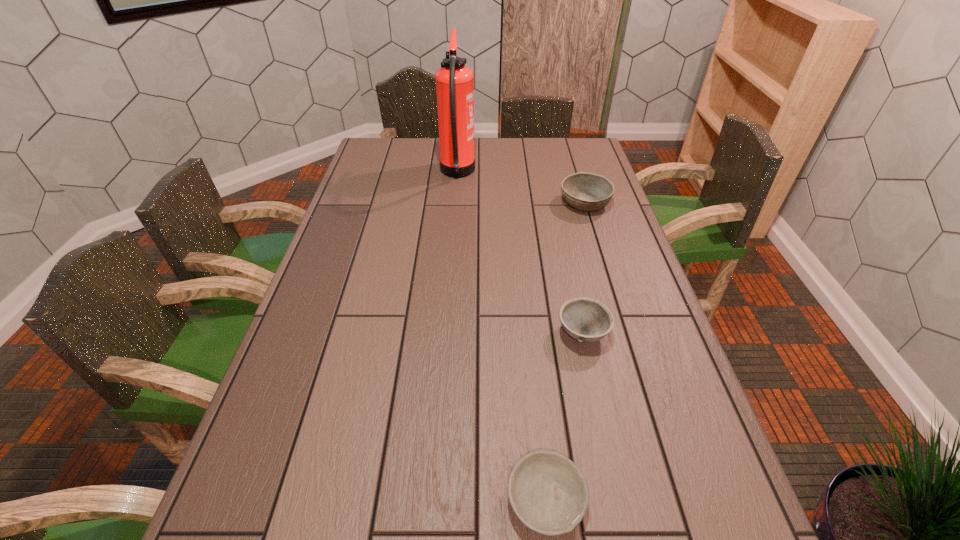
The height and width of the screenshot is (540, 960). In order to click on free region at the right edge of the desktop in this screenshot , I will do `click(636, 300)`.

Image resolution: width=960 pixels, height=540 pixels. In order to click on vacant space at the far left corner of the desktop in this screenshot , I will do `click(374, 163)`.

Where is `free space between the farthest bowl and the tallest object`? This screenshot has height=540, width=960. free space between the farthest bowl and the tallest object is located at coordinates (521, 188).

This screenshot has width=960, height=540. Find the location of `empty space that is in between the leftmost object and the farthest bowl`. empty space that is in between the leftmost object and the farthest bowl is located at coordinates (521, 188).

Identify the location of vacant space that's between the tallest object and the second farthest bowl. (520, 253).

The image size is (960, 540). Find the location of `vacant region between the tallest object and the second nearest bowl`. vacant region between the tallest object and the second nearest bowl is located at coordinates (520, 253).

Locate an element on the screen. The image size is (960, 540). free spot between the second nearest bowl and the farthest bowl is located at coordinates (584, 268).

Locate an element on the screen. The height and width of the screenshot is (540, 960). free space between the leftmost object and the farthest bowl is located at coordinates (521, 188).

Locate which object ranks second in proximity to the second farthest bowl. Please provide its 2D coordinates. Your answer should be formatted as a tuple, i.e. [(x, y)], where the tuple contains the x and y coordinates of a point satisfying the conditions above.

[(588, 192)]

Locate which object ranks in proximity to the shortest object. Please provide its 2D coordinates. Your answer should be formatted as a tuple, i.e. [(x, y)], where the tuple contains the x and y coordinates of a point satisfying the conditions above.

[(585, 319)]